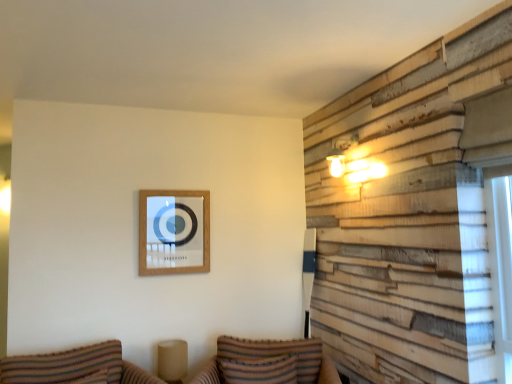
Question: Is striped fabric pillow at lower center positioned beyond the bounds of striped fabric couch at lower left, acting as the first couch starting from the left?

Choices:
 (A) yes
 (B) no

Answer: (A)

Question: From a real-world perspective, is striped fabric pillow at lower center on top of striped fabric couch at lower left, which is counted as the 2th couch, starting from the right?

Choices:
 (A) yes
 (B) no

Answer: (A)

Question: Does striped fabric pillow at lower center have a smaller size compared to striped fabric couch at lower left, acting as the first couch starting from the left?

Choices:
 (A) no
 (B) yes

Answer: (B)

Question: Is there a large distance between striped fabric pillow at lower center and striped fabric couch at lower left, which is counted as the 2th couch, starting from the right?

Choices:
 (A) no
 (B) yes

Answer: (A)

Question: Considering the relative sizes of striped fabric pillow at lower center and striped fabric couch at lower left, which is counted as the 2th couch, starting from the right, in the image provided, is striped fabric pillow at lower center bigger than striped fabric couch at lower left, which is counted as the 2th couch, starting from the right,?

Choices:
 (A) no
 (B) yes

Answer: (A)

Question: Choose the correct answer: Is wooden picture frame at upper center inside striped fabric couch at lower left, acting as the first couch starting from the left, or outside it?

Choices:
 (A) inside
 (B) outside

Answer: (B)

Question: Visually, is wooden picture frame at upper center positioned to the left or to the right of striped fabric couch at lower left, which is counted as the 2th couch, starting from the right?

Choices:
 (A) right
 (B) left

Answer: (A)

Question: Is point (166, 198) positioned closer to the camera than point (114, 369)?

Choices:
 (A) closer
 (B) farther

Answer: (B)

Question: Is wooden picture frame at upper center bigger or smaller than striped fabric couch at lower left, which is counted as the 2th couch, starting from the right?

Choices:
 (A) small
 (B) big

Answer: (A)

Question: Would you say striped fabric couch at lower left, acting as the first couch starting from the left, is to the left or to the right of wooden picture frame at upper center in the picture?

Choices:
 (A) right
 (B) left

Answer: (B)

Question: Considering the positions of point (53, 379) and point (190, 243), is point (53, 379) closer or farther from the camera than point (190, 243)?

Choices:
 (A) closer
 (B) farther

Answer: (A)

Question: Considering their positions, is striped fabric couch at lower left, acting as the first couch starting from the left, located in front of or behind wooden picture frame at upper center?

Choices:
 (A) behind
 (B) front

Answer: (B)

Question: From the image's perspective, relative to wooden picture frame at upper center, is striped fabric couch at lower left, acting as the first couch starting from the left, above or below?

Choices:
 (A) above
 (B) below

Answer: (B)

Question: In terms of size, does striped fabric couch at lower left, acting as the first couch starting from the left, appear bigger or smaller than striped fabric couch at lower center, the 2th couch when ordered from left to right?

Choices:
 (A) big
 (B) small

Answer: (B)

Question: Relative to striped fabric couch at lower center, which is the first couch in right-to-left order, is striped fabric couch at lower left, acting as the first couch starting from the left, in front or behind?

Choices:
 (A) front
 (B) behind

Answer: (A)